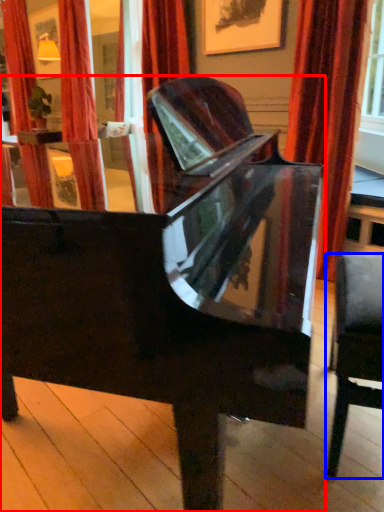
Question: Which object is closer to the camera taking this photo, piano (highlighted by a red box) or chair (highlighted by a blue box)?

Choices:
 (A) piano
 (B) chair

Answer: (A)